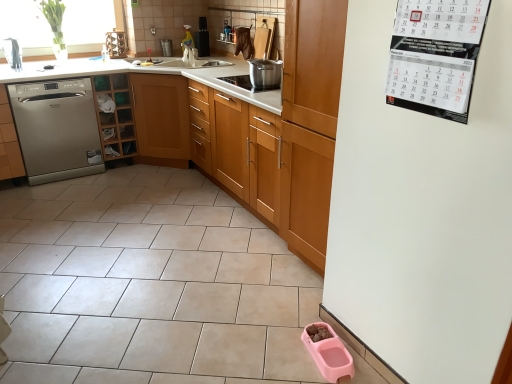
Question: Is the position of stainless steel pot at center more distant than that of pink plastic pet food bowl at lower right?

Choices:
 (A) yes
 (B) no

Answer: (A)

Question: From a real-world perspective, is stainless steel pot at center beneath pink plastic pet food bowl at lower right?

Choices:
 (A) no
 (B) yes

Answer: (A)

Question: Is stainless steel pot at center facing away from pink plastic pet food bowl at lower right?

Choices:
 (A) no
 (B) yes

Answer: (A)

Question: Are stainless steel pot at center and pink plastic pet food bowl at lower right making contact?

Choices:
 (A) no
 (B) yes

Answer: (A)

Question: Considering the relative positions of stainless steel pot at center and pink plastic pet food bowl at lower right in the image provided, is stainless steel pot at center to the left of pink plastic pet food bowl at lower right from the viewer's perspective?

Choices:
 (A) no
 (B) yes

Answer: (B)

Question: Is stainless steel pot at center wider than pink plastic pet food bowl at lower right?

Choices:
 (A) yes
 (B) no

Answer: (A)

Question: Can you confirm if pink plastic pet food bowl at lower right is thinner than satin silver dishwasher at left?

Choices:
 (A) yes
 (B) no

Answer: (A)

Question: Considering the relative sizes of pink plastic pet food bowl at lower right and satin silver dishwasher at left in the image provided, is pink plastic pet food bowl at lower right taller than satin silver dishwasher at left?

Choices:
 (A) yes
 (B) no

Answer: (B)

Question: Is pink plastic pet food bowl at lower right in front of satin silver dishwasher at left?

Choices:
 (A) yes
 (B) no

Answer: (A)

Question: Can you confirm if pink plastic pet food bowl at lower right is smaller than satin silver dishwasher at left?

Choices:
 (A) yes
 (B) no

Answer: (A)

Question: Is the surface of pink plastic pet food bowl at lower right in direct contact with satin silver dishwasher at left?

Choices:
 (A) no
 (B) yes

Answer: (A)

Question: Does pink plastic pet food bowl at lower right come behind satin silver dishwasher at left?

Choices:
 (A) no
 (B) yes

Answer: (A)

Question: Is pink plastic pet food bowl at lower right further to the viewer compared to wooden cabinet at center, which is the third cabinetry in left-to-right order?

Choices:
 (A) yes
 (B) no

Answer: (B)